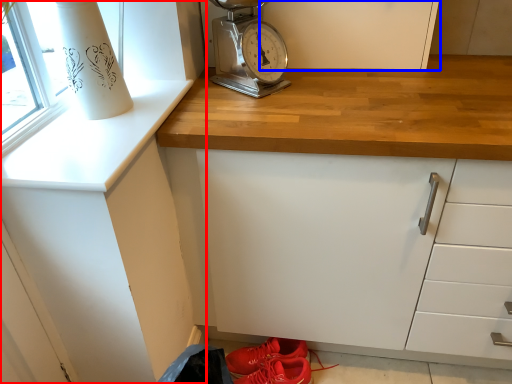
Question: Which point is closer to the camera, cabinetry (highlighted by a red box) or cabinetry (highlighted by a blue box)?

Choices:
 (A) cabinetry
 (B) cabinetry

Answer: (A)